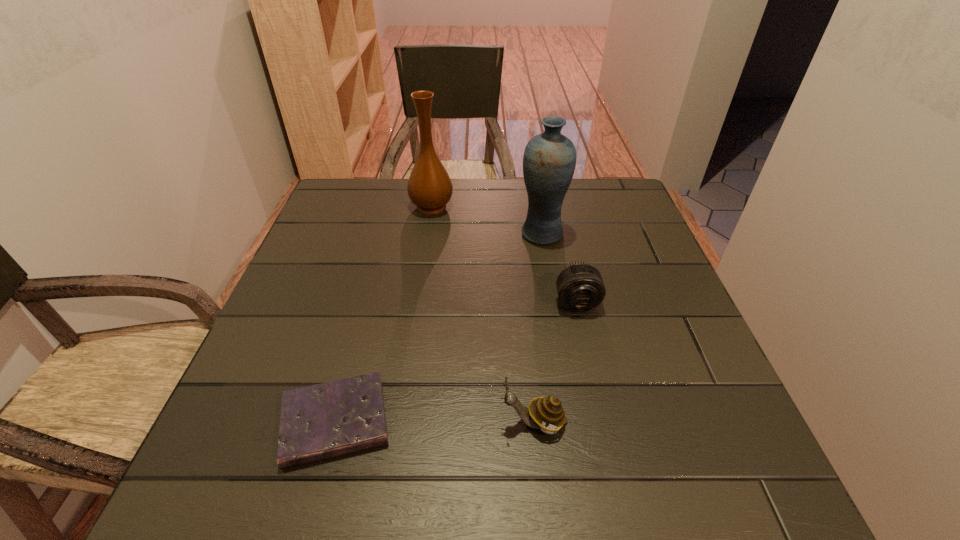
Find the location of a particular element. The width and height of the screenshot is (960, 540). free space at the left edge of the desktop is located at coordinates (318, 333).

In the image, there is a desktop. Where is `vacant space at the right edge`? vacant space at the right edge is located at coordinates (664, 356).

In the image, there is a desktop. Where is `vacant space at the far left corner`? vacant space at the far left corner is located at coordinates (336, 197).

At what (x,y) coordinates should I click in order to perform the action: click on blank space at the far right corner of the desktop. Please return your answer as a coordinate pair (x, y). The image size is (960, 540). Looking at the image, I should click on (607, 189).

The width and height of the screenshot is (960, 540). I want to click on vacant space in between the third farthest object and the third shortest object, so click(555, 362).

Where is `free area in between the second shortest object and the shortest object`? The image size is (960, 540). free area in between the second shortest object and the shortest object is located at coordinates (456, 362).

This screenshot has width=960, height=540. Identify the location of blank region between the telephoto lens and the snail. (555, 362).

You are a GUI agent. You are given a task and a screenshot of the screen. Output one action in this format:
    pyautogui.click(x=<x>, y=<y>)
    Task: Click on the unoccupied area between the third nearest object and the snail
    This screenshot has width=960, height=540.
    Given the screenshot: What is the action you would take?
    pyautogui.click(x=555, y=362)

The width and height of the screenshot is (960, 540). I want to click on empty location between the farthest object and the second shortest object, so click(504, 254).

Where is `empty space that is in between the farthest object and the shortest object`? empty space that is in between the farthest object and the shortest object is located at coordinates (384, 314).